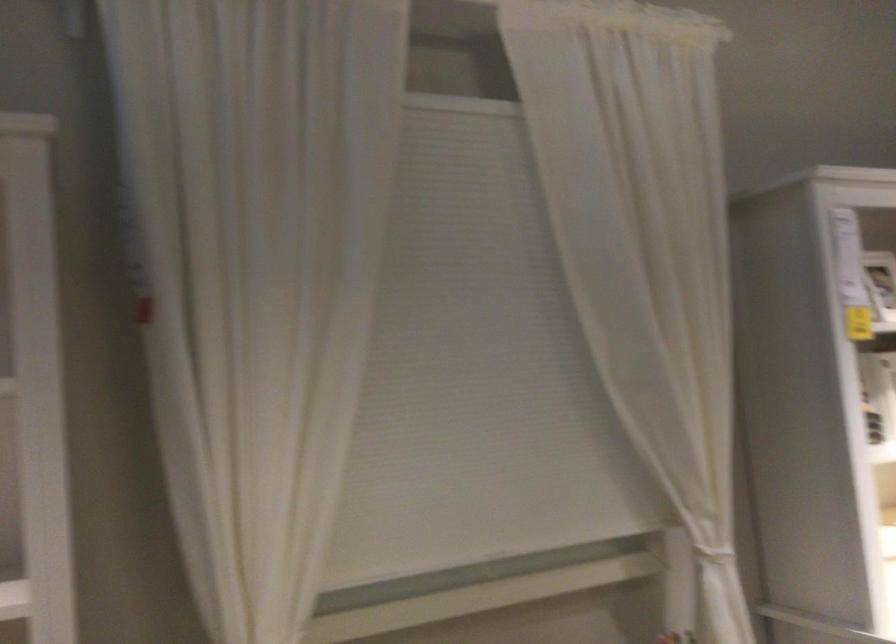
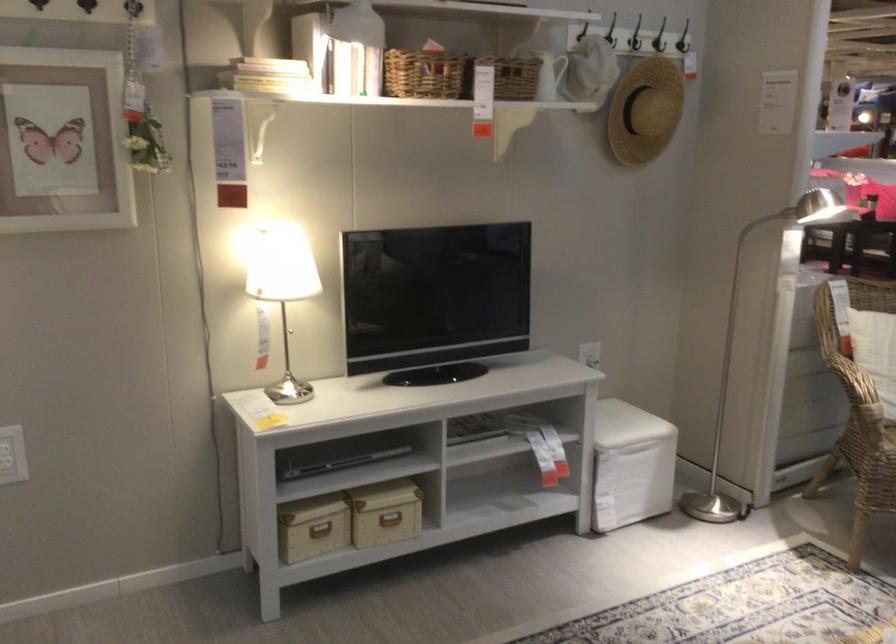
Question: The camera is either moving clockwise (left) or counter-clockwise (right) around the object. The first image is from the beginning of the video and the second image is from the end. Is the camera moving left or right when shooting the video?

Choices:
 (A) Left
 (B) Right

Answer: (A)